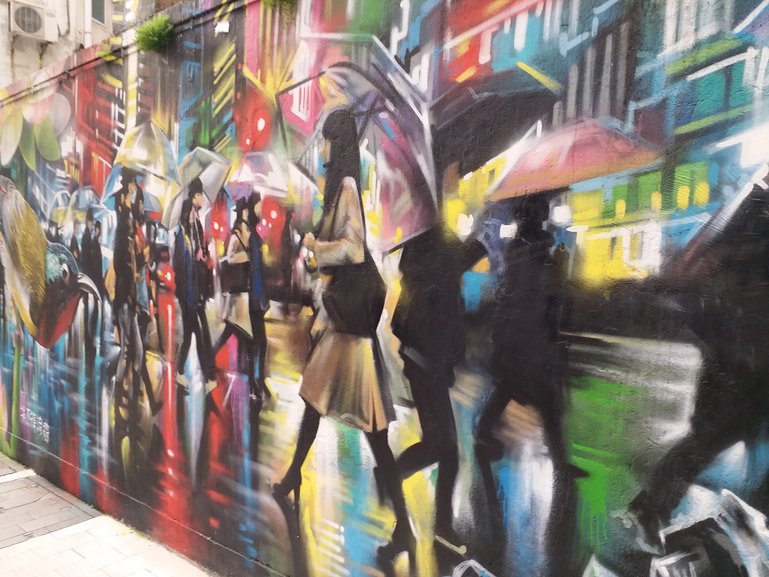
The height and width of the screenshot is (577, 769). In order to click on lights in this screenshot , I will do `click(263, 132)`.